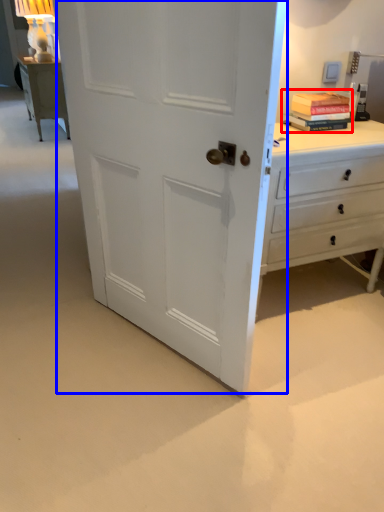
Question: Which of the following is the closest to the observer, book (highlighted by a red box) or door (highlighted by a blue box)?

Choices:
 (A) book
 (B) door

Answer: (B)